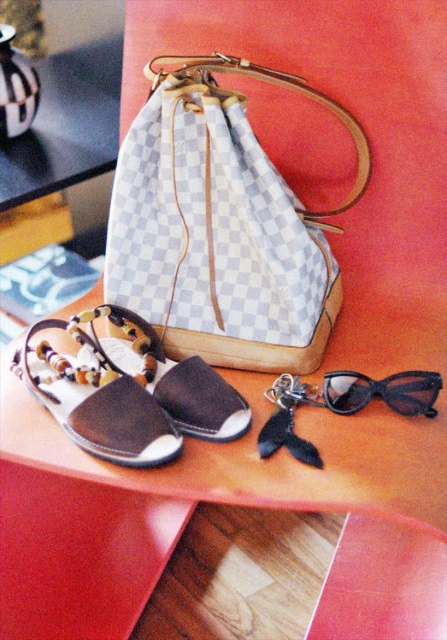
Question: In this image, where is white checkered fabric handbag at center located relative to brown leather sandal at lower left?

Choices:
 (A) right
 (B) left

Answer: (A)

Question: Does brown leather sandal at lower left have a greater width compared to black plastic sunglasses at lower right?

Choices:
 (A) yes
 (B) no

Answer: (A)

Question: In this image, where is white checkered fabric handbag at center located relative to brown leather sandal at lower left?

Choices:
 (A) below
 (B) above

Answer: (B)

Question: Considering the real-world distances, which object is closest to the white checkered fabric handbag at center?

Choices:
 (A) black plastic sunglasses at lower right
 (B) brown suede sandal at lower left

Answer: (B)

Question: Which object appears farthest from the camera in this image?

Choices:
 (A) brown suede sandal at lower left
 (B) white checkered fabric handbag at center
 (C) brown leather sandal at lower left

Answer: (C)

Question: Which object is closer to the camera taking this photo?

Choices:
 (A) brown suede sandal at lower left
 (B) black plastic sunglasses at lower right
 (C) brown leather sandal at lower left
 (D) white checkered fabric handbag at center

Answer: (D)